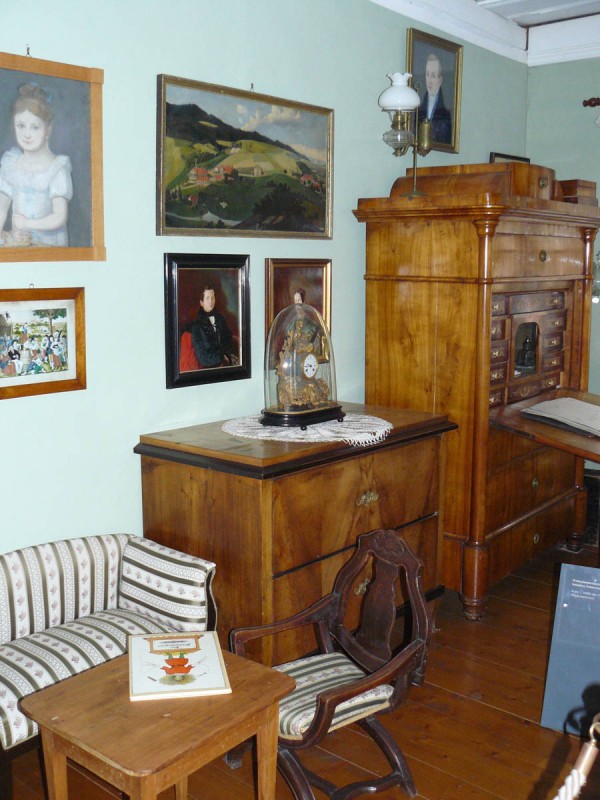
This screenshot has width=600, height=800. Find the location of `chair`. chair is located at coordinates (331, 682).